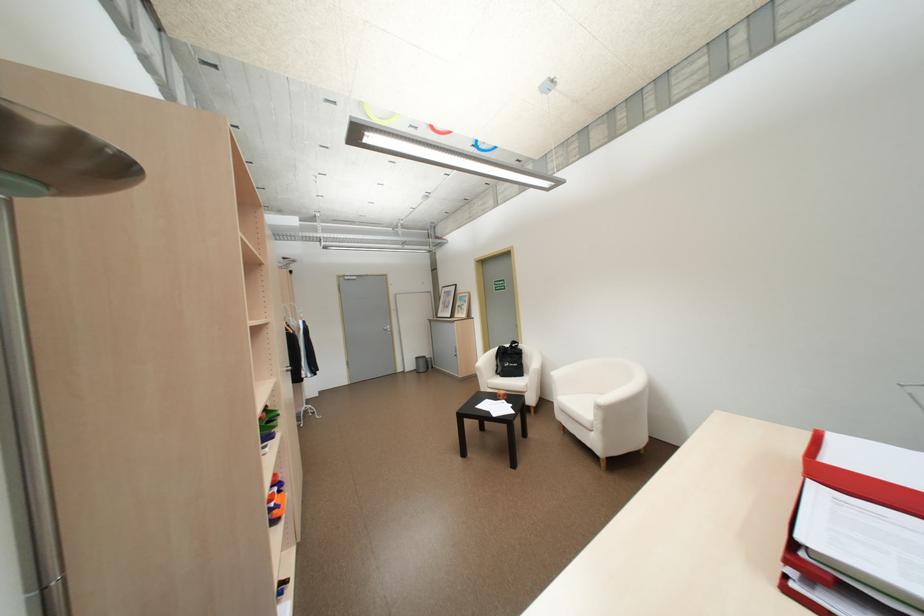
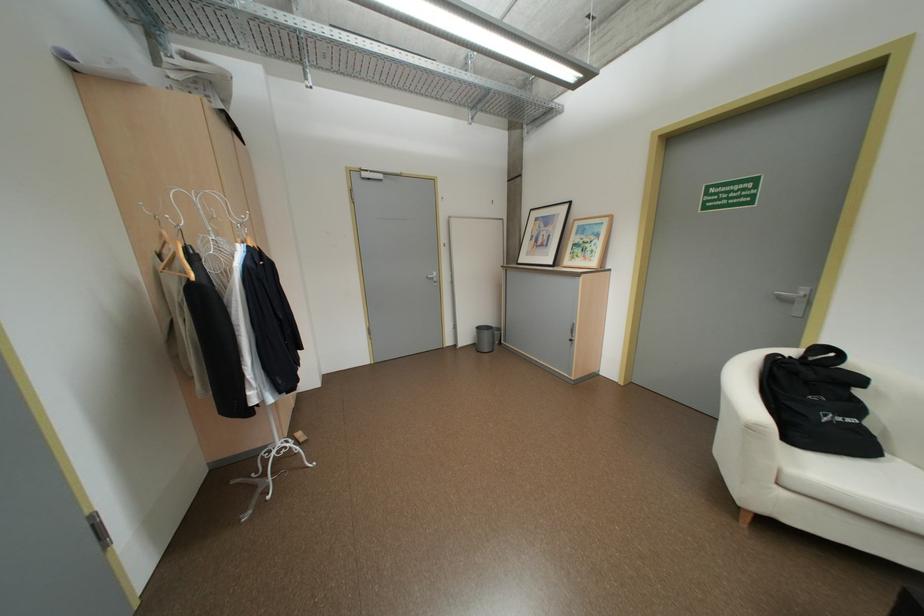
In the second image, find the point that corresponds to the point at 457,293 in the first image.

(556, 220)